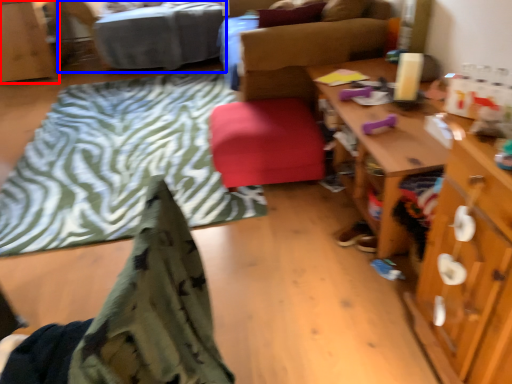
Question: Which object appears closest to the camera in this image, cabinetry (highlighted by a red box) or bed (highlighted by a blue box)?

Choices:
 (A) cabinetry
 (B) bed

Answer: (B)